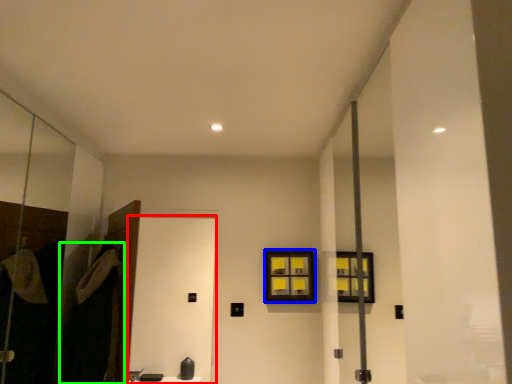
Question: Considering the real-world distances, which object is farthest from screen door (highlighted by a red box)? window (highlighted by a blue box) or robe (highlighted by a green box)?

Choices:
 (A) window
 (B) robe

Answer: (B)